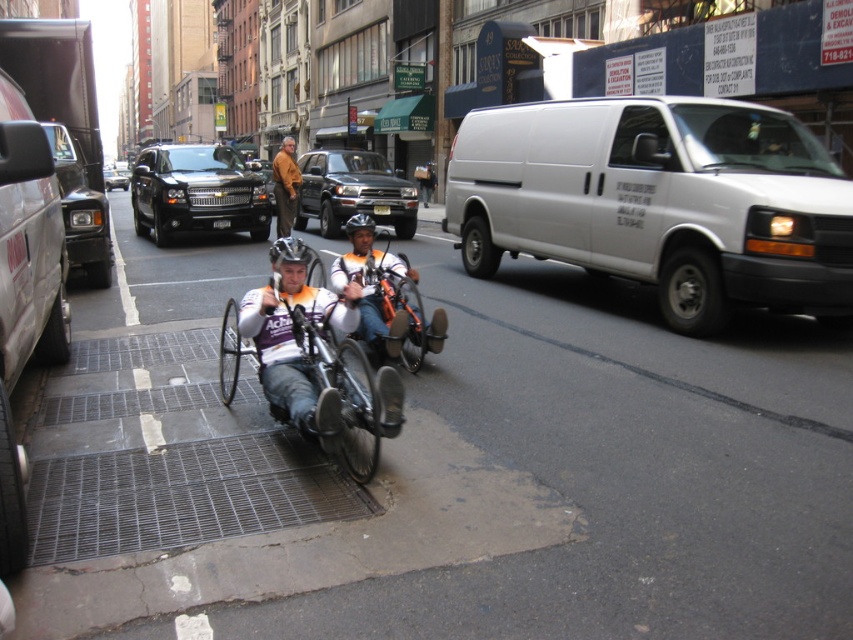
Question: Does shiny black suv at center appear on the left side of matte black suv at center?

Choices:
 (A) no
 (B) yes

Answer: (B)

Question: Which of the following is the farthest from the observer?

Choices:
 (A) (111, 186)
 (B) (265, 387)

Answer: (A)

Question: Which object appears farthest from the camera in this image?

Choices:
 (A) shiny black suv at center
 (B) white matte van at center
 (C) black glossy suv at center-left
 (D) matte black suv at center

Answer: (A)

Question: Which object is the closest to the black glossy suv at center-left?

Choices:
 (A) shiny black suv at center
 (B) matte black tricycle at center

Answer: (A)

Question: Can you confirm if orange metallic wheelchair at center is wider than brown leather jacket at center?

Choices:
 (A) yes
 (B) no

Answer: (B)

Question: Can you confirm if orange metallic wheelchair at center is thinner than brown leather jacket at center?

Choices:
 (A) yes
 (B) no

Answer: (A)